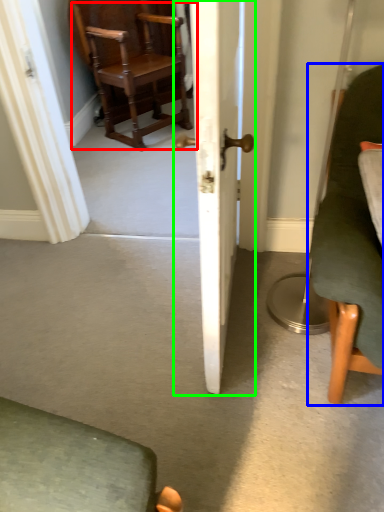
Question: Based on their relative distances, which object is nearer to chair (highlighted by a red box)? Choose from chair (highlighted by a blue box) and door (highlighted by a green box).

Choices:
 (A) chair
 (B) door

Answer: (B)